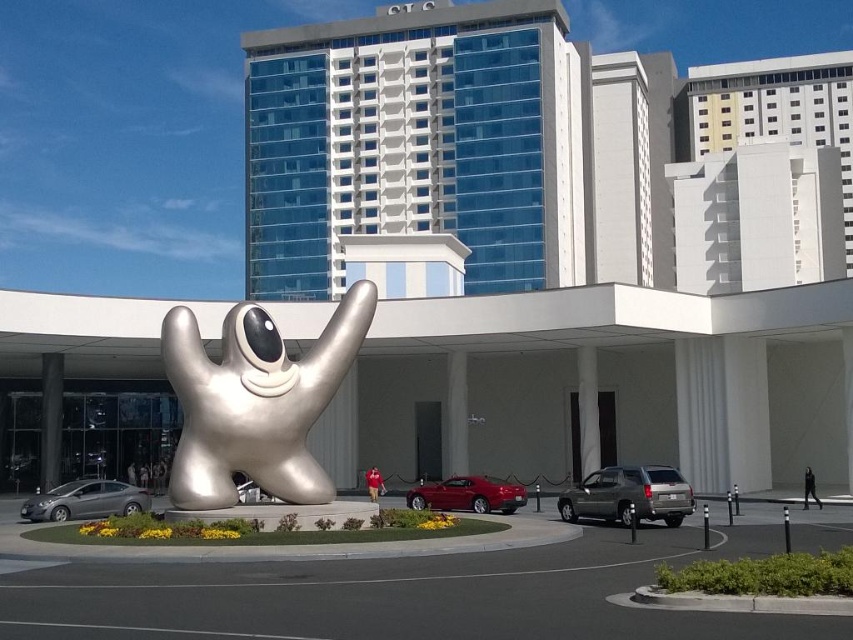
Question: Which of these objects is positioned closest to the matte gray suv at center?

Choices:
 (A) silver metallic sedan at lower left
 (B) silver metallic sculpture at center

Answer: (B)

Question: Is matte gray suv at center behind glossy red car at center?

Choices:
 (A) yes
 (B) no

Answer: (B)

Question: Estimate the real-world distances between objects in this image. Which object is closer to the silver metallic sedan at lower left?

Choices:
 (A) matte gray suv at center
 (B) silver metallic sculpture at center

Answer: (B)

Question: Does silver metallic sculpture at center appear on the right side of silver metallic sedan at lower left?

Choices:
 (A) yes
 (B) no

Answer: (A)

Question: Is matte gray suv at center closer to the viewer compared to glossy red car at center?

Choices:
 (A) no
 (B) yes

Answer: (B)

Question: Which object is closer to the camera taking this photo?

Choices:
 (A) glossy red car at center
 (B) silver metallic sculpture at center
 (C) silver metallic sedan at lower left
 (D) matte gray suv at center

Answer: (B)